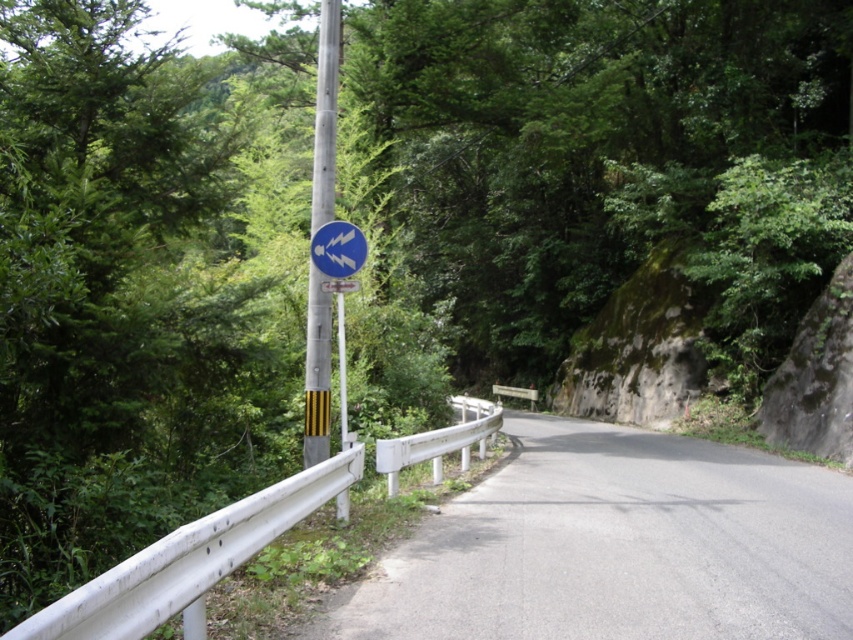
You are a hiker standing on the road and see the metallic pole at center and the blue glossy sign at upper center. Which object is closer to you?

The metallic pole at center is closer to you than the blue glossy sign at upper center because it is further to the viewer.

You are a hiker who wants to take a photo of the blue glossy sign at upper center. You are standing next to the metallic pole at center. Can you stand on the pole to get a better angle for the photo?

The metallic pole at center is not as tall as the blue glossy sign at upper center, so standing on the pole would not help you reach a better angle for the photo.